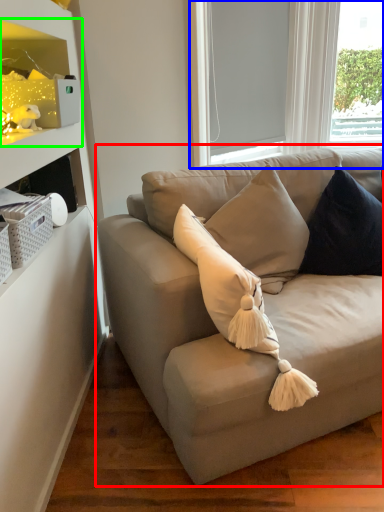
Question: Which object is positioned closest to studio couch (highlighted by a red box)? Select from bay window (highlighted by a blue box) and shelf (highlighted by a green box).

Choices:
 (A) bay window
 (B) shelf

Answer: (B)